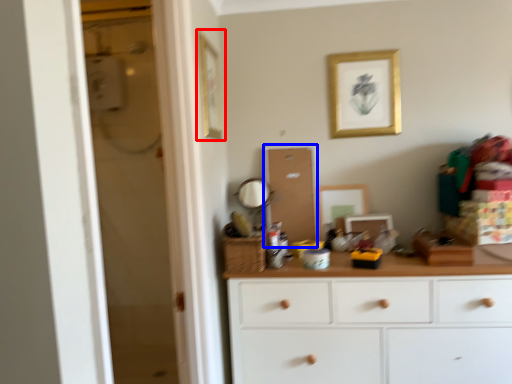
Question: Which of the following is the closest to the observer, picture frame (highlighted by a red box) or screen door (highlighted by a blue box)?

Choices:
 (A) picture frame
 (B) screen door

Answer: (A)